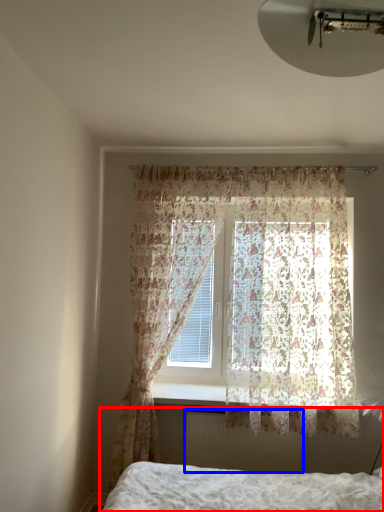
Question: Among these objects, which one is farthest to the camera, bed (highlighted by a red box) or radiator (highlighted by a blue box)?

Choices:
 (A) bed
 (B) radiator

Answer: (B)